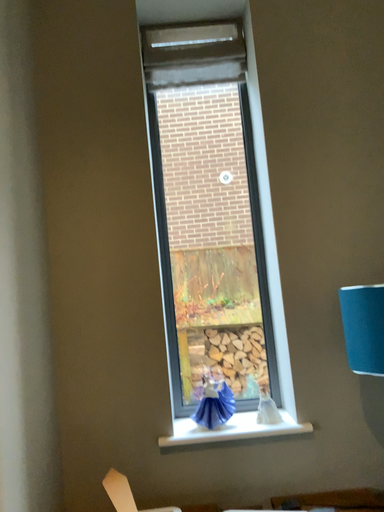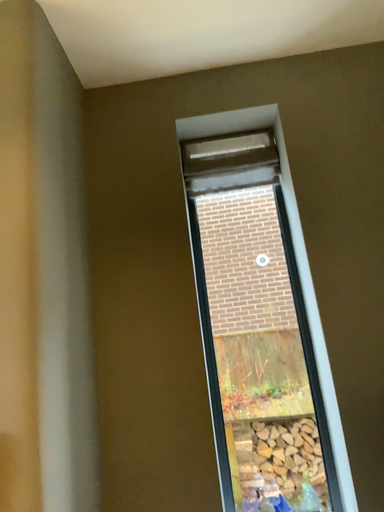
Question: Which way did the camera rotate in the video?

Choices:
 (A) rotated upward
 (B) rotated downward

Answer: (A)